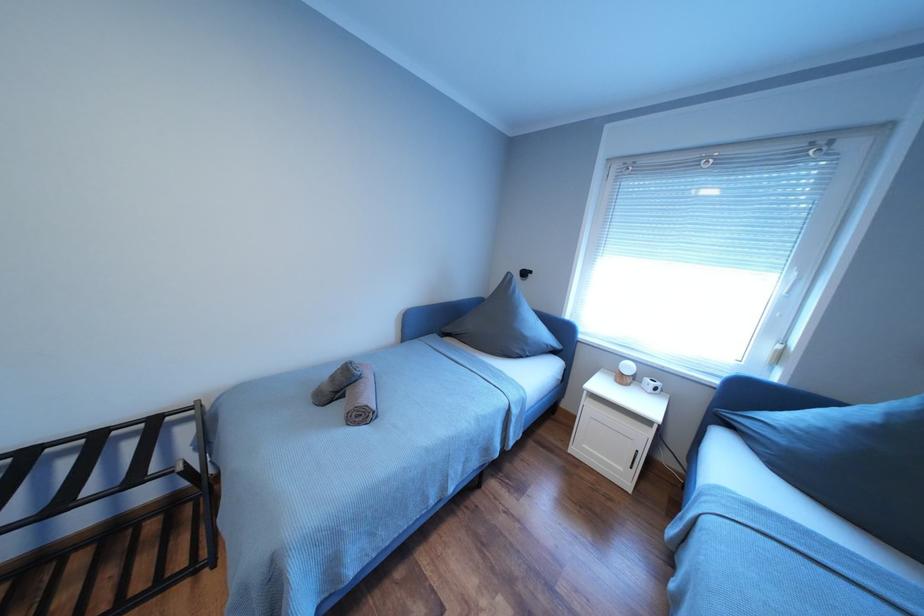
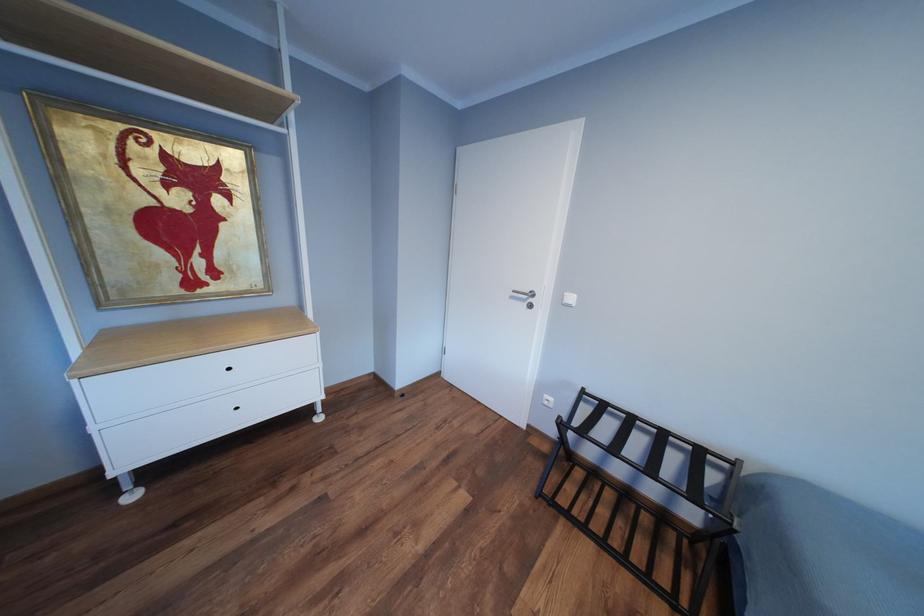
Question: The camera is either moving clockwise (left) or counter-clockwise (right) around the object. The first image is from the beginning of the video and the second image is from the end. Is the camera moving left or right when shooting the video?

Choices:
 (A) Left
 (B) Right

Answer: (B)